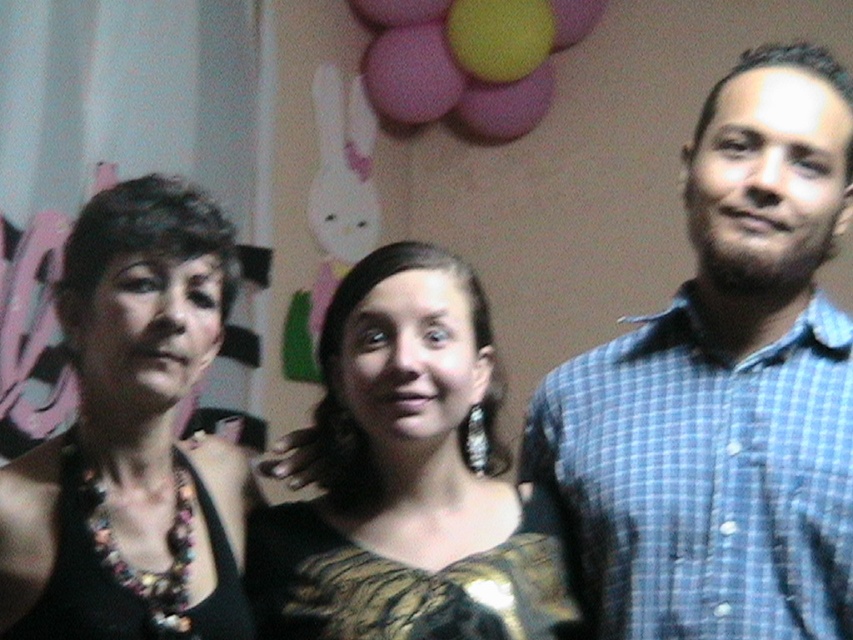
Question: Which point is closer to the camera?

Choices:
 (A) blue checkered shirt at right
 (B) black dress at center

Answer: (B)

Question: Which object is closer to the camera taking this photo?

Choices:
 (A) gold textured dress at center
 (B) black matte necklace at left
 (C) pink matte balloon at upper center
 (D) blue checkered shirt at right

Answer: (A)

Question: In this image, where is black dress at center located relative to pink matte balloon at upper center?

Choices:
 (A) above
 (B) below

Answer: (B)

Question: Which of the following is the closest to the observer?

Choices:
 (A) gold textured dress at center
 (B) blue checkered shirt at right

Answer: (A)

Question: Is black dress at center bigger than blue checkered shirt at right?

Choices:
 (A) yes
 (B) no

Answer: (A)

Question: In this image, where is black dress at center located relative to black matte necklace at left?

Choices:
 (A) left
 (B) right

Answer: (B)